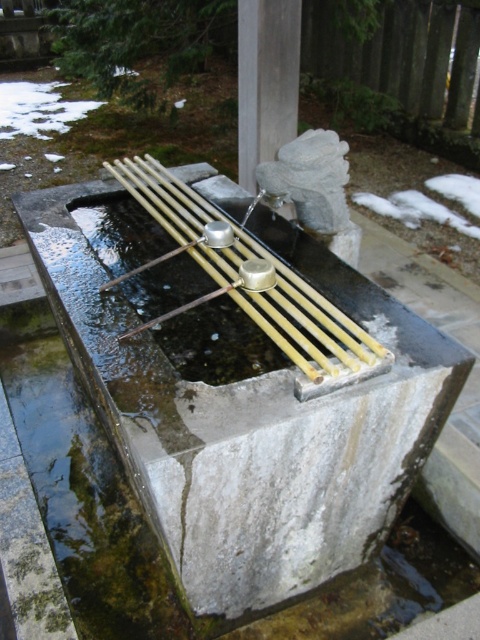
You are standing in front of a traditional Japanese water purification fountain at a Shinto shrine. You need to pour water from a small bucket into the smooth concrete basin at center. Is the basin within your arm reach?

The smooth concrete basin at center is 4.11 feet away from you, which is slightly beyond typical arm reach. You may need to step forward or extend your arm fully to pour the water into it.

You are a visitor to the shrine and want to pour water from the smooth concrete basin at center onto your hands. However, there is a small child standing 1 meter away from you. Is there enough space between you and the basin to perform the purification ritual without bumping into the child?

The smooth concrete basin at center is 1.25 meters away from you, so yes, there is enough space between you and the basin to perform the purification ritual without bumping into the child who is 1 meter away.

You are standing at the entrance of the Shinto shrine and see two points marked in the scene. The first point is at coordinate point (116, 163) and the second is at point (256, 10). Which point is closer to you as you face the fountain?

Point (116, 163) is in front of point (256, 10), so it is closer to you as you face the fountain.